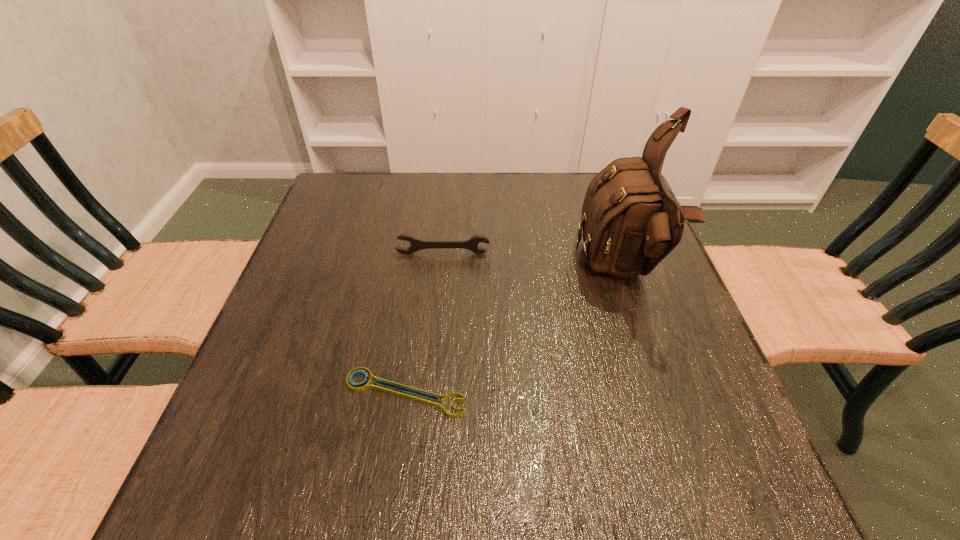
Choose which object is the second nearest neighbor to the farther wrench. Please provide its 2D coordinates. Your answer should be formatted as a tuple, i.e. [(x, y)], where the tuple contains the x and y coordinates of a point satisfying the conditions above.

[(361, 386)]